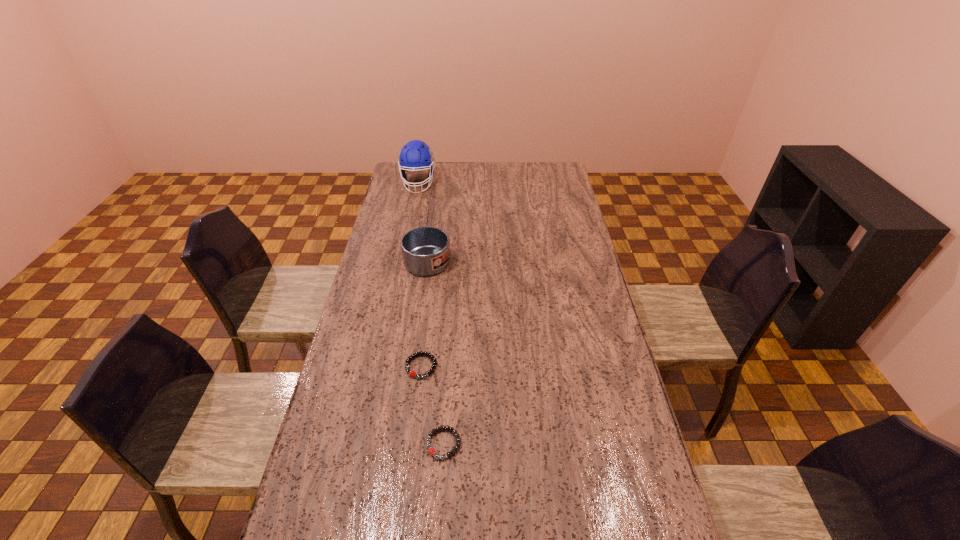
The height and width of the screenshot is (540, 960). In order to click on the farthest object in this screenshot , I will do `click(416, 155)`.

Locate an element on the screen. football helmet is located at coordinates (416, 155).

Where is `saucepan`? The image size is (960, 540). saucepan is located at coordinates (426, 250).

In order to click on the third shortest object in this screenshot , I will do `click(426, 250)`.

I want to click on the farther bracelet, so click(x=412, y=373).

Image resolution: width=960 pixels, height=540 pixels. Identify the location of the nearest object. (432, 451).

Find the location of `blank space located on the face guard of the tallest object`. blank space located on the face guard of the tallest object is located at coordinates (408, 234).

Where is `free region located 0.170m with the handle extending from one side of the third nearest object`? Image resolution: width=960 pixels, height=540 pixels. free region located 0.170m with the handle extending from one side of the third nearest object is located at coordinates (437, 194).

Identify the location of vacant region located 0.170m with the handle extending from one side of the third nearest object. 437,194.

The image size is (960, 540). Identify the location of vacant region located 0.390m with the handle extending from one side of the third nearest object. (440, 172).